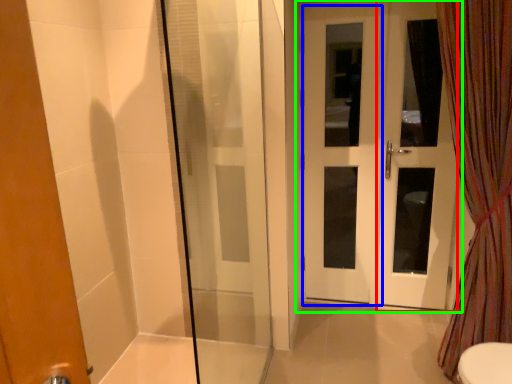
Question: Which is farther away from screen door (highlighted by a red box)? screen door (highlighted by a blue box) or door (highlighted by a green box)?

Choices:
 (A) screen door
 (B) door

Answer: (A)